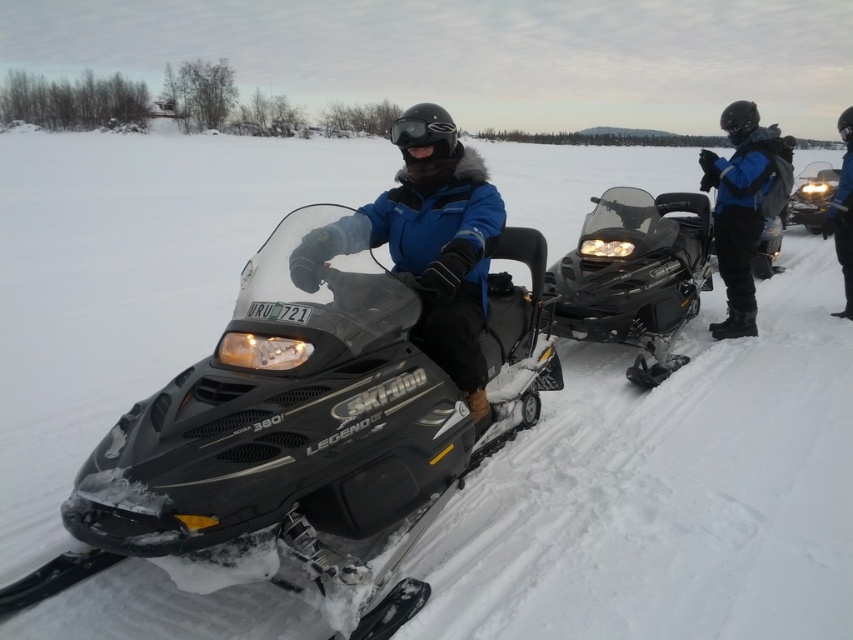
Which is above, blue matte jacket at center or blue fabric jacket at upper center?

blue fabric jacket at upper center is above.

Who is positioned more to the right, blue matte jacket at center or blue fabric jacket at upper center?

Positioned to the right is blue fabric jacket at upper center.

You are a GUI agent. You are given a task and a screenshot of the screen. Output one action in this format:
    pyautogui.click(x=<x>, y=<y>)
    Task: Click on the blue matte jacket at center
    Image resolution: width=853 pixels, height=640 pixels.
    Given the screenshot: What is the action you would take?
    click(743, 205)

Find the location of a particular element. blue matte jacket at center is located at coordinates (743, 205).

Which is behind, point (398, 208) or point (640, 228)?

The point (640, 228) is behind.

Measure the distance between matte blue jacket at center and camera.

The distance of matte blue jacket at center from camera is 8.07 feet.

This screenshot has height=640, width=853. In order to click on matte blue jacket at center in this screenshot , I will do coord(440,241).

Which is below, matte blue jacket at center or blue fabric jacket at upper center?

matte blue jacket at center is below.

Does point (422, 166) come farther from viewer compared to point (840, 259)?

No, (422, 166) is in front of (840, 259).

You are a GUI agent. You are given a task and a screenshot of the screen. Output one action in this format:
    pyautogui.click(x=<x>, y=<y>)
    Task: Click on the matte blue jacket at center
    This screenshot has width=853, height=640.
    Given the screenshot: What is the action you would take?
    pyautogui.click(x=440, y=241)

At what (x,y) coordinates should I click in order to perform the action: click on matte blue jacket at center. Please return your answer as a coordinate pair (x, y). This screenshot has height=640, width=853. Looking at the image, I should click on [x=440, y=241].